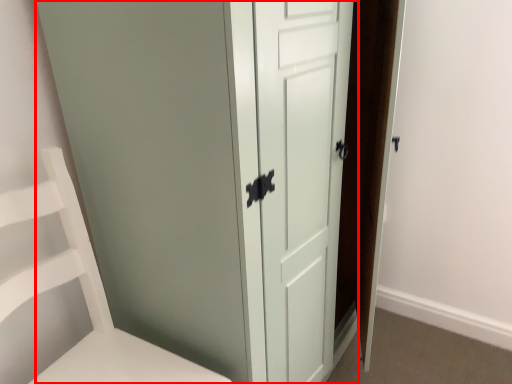
Question: Considering the relative positions of door (annotated by the red box) and furniture in the image provided, where is door (annotated by the red box) located with respect to the staircase?

Choices:
 (A) right
 (B) left

Answer: (A)